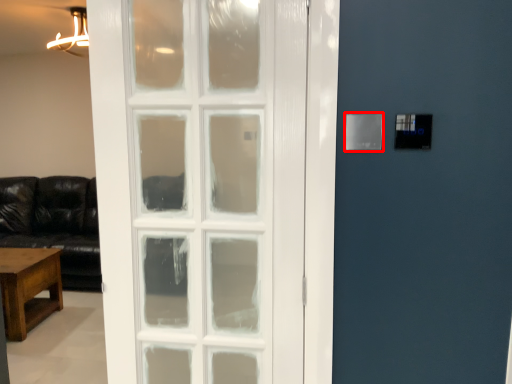
Question: In this image, where is light switch (annotated by the red box) located relative to table?

Choices:
 (A) right
 (B) left

Answer: (A)